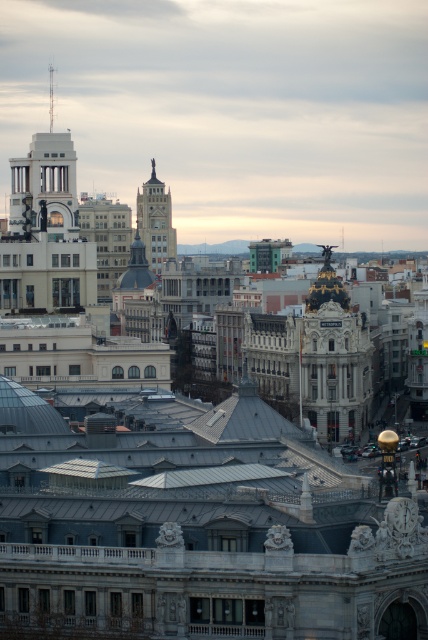
Question: Which point is closer to the camera taking this photo?

Choices:
 (A) (157, 240)
 (B) (53, 93)

Answer: (A)

Question: From the image, what is the correct spatial relationship of matte gray tower at center in relation to smooth silver spire at upper left?

Choices:
 (A) below
 (B) above

Answer: (A)

Question: Is matte gray tower at center below smooth silver spire at upper left?

Choices:
 (A) yes
 (B) no

Answer: (A)

Question: Which object is closer to the camera taking this photo?

Choices:
 (A) smooth silver spire at upper left
 (B) matte gray tower at center

Answer: (B)

Question: Which point appears farthest from the camera in this image?

Choices:
 (A) (148, 259)
 (B) (48, 109)

Answer: (B)

Question: Does matte gray tower at center have a greater width compared to smooth silver spire at upper left?

Choices:
 (A) yes
 (B) no

Answer: (A)